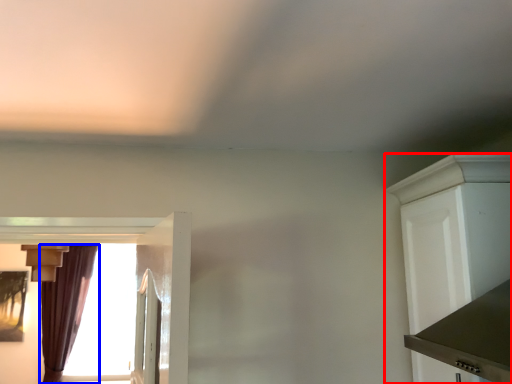
Question: Which of the following is the farthest to the observer, cabinetry (highlighted by a red box) or curtain (highlighted by a blue box)?

Choices:
 (A) cabinetry
 (B) curtain

Answer: (B)